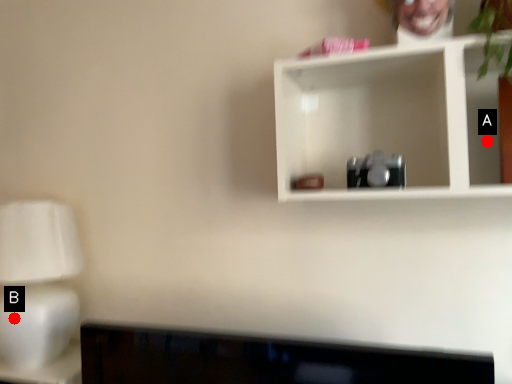
Question: Two points are circled on the image, labeled by A and B beside each circle. Which of the following is the closest to the observer?

Choices:
 (A) A is closer
 (B) B is closer

Answer: (A)